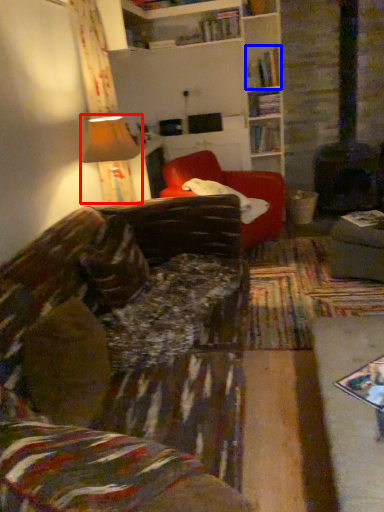
Question: Which object is further to the camera taking this photo, lamp (highlighted by a red box) or book (highlighted by a blue box)?

Choices:
 (A) lamp
 (B) book

Answer: (B)